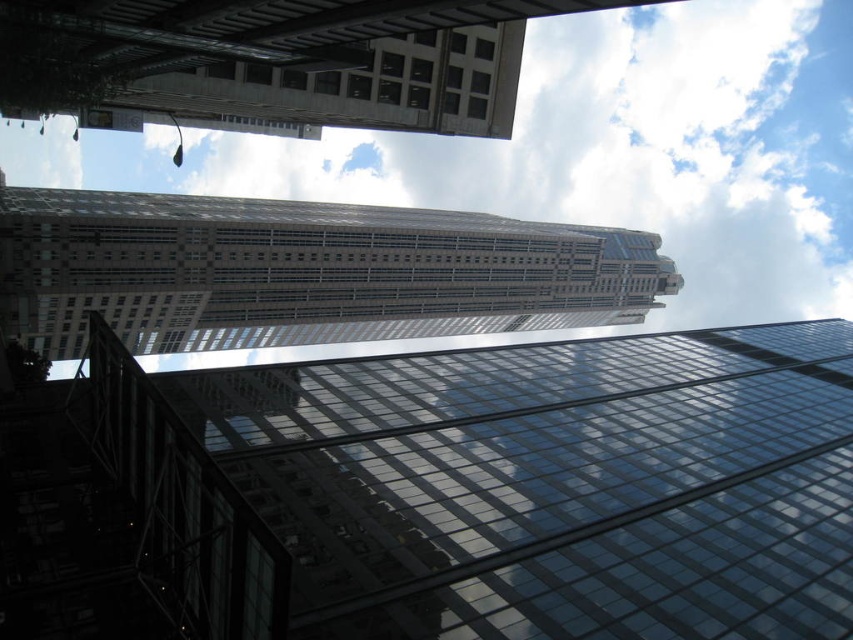
Question: Which point is closer to the camera?

Choices:
 (A) (195, 186)
 (B) (368, 205)

Answer: (B)

Question: Which point is farther to the camera?

Choices:
 (A) white fluffy cloud at upper center
 (B) transparent glass building at center
 (C) glassy steel skyscraper at upper center

Answer: (A)

Question: Can you confirm if white fluffy cloud at upper center is positioned to the right of glassy steel skyscraper at upper center?

Choices:
 (A) yes
 (B) no

Answer: (A)

Question: Which point is closer to the camera taking this photo?

Choices:
 (A) (195, 422)
 (B) (515, 260)
 (C) (692, 56)

Answer: (A)

Question: Does transparent glass building at center have a smaller size compared to white fluffy cloud at upper center?

Choices:
 (A) yes
 (B) no

Answer: (A)

Question: Is transparent glass building at center thinner than white fluffy cloud at upper center?

Choices:
 (A) no
 (B) yes

Answer: (B)